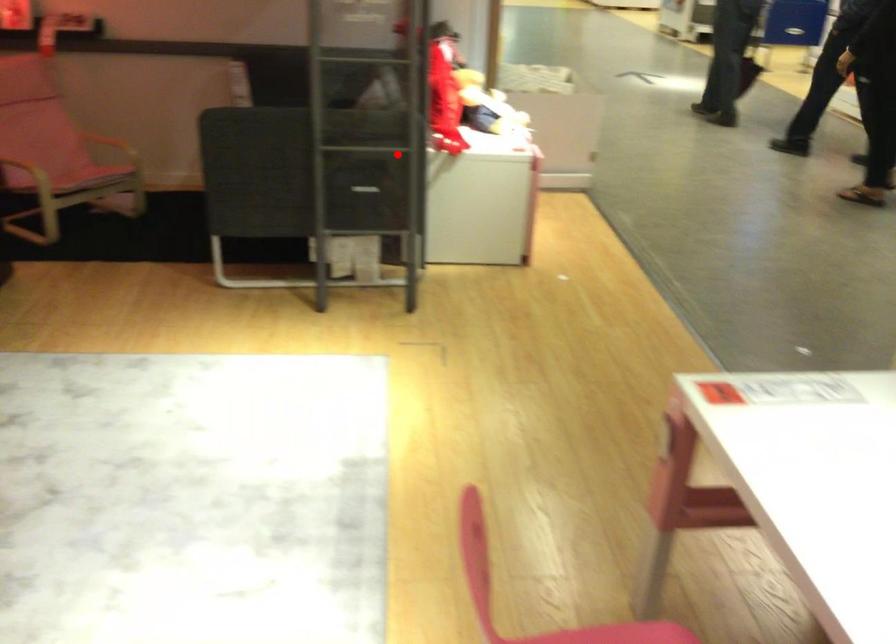
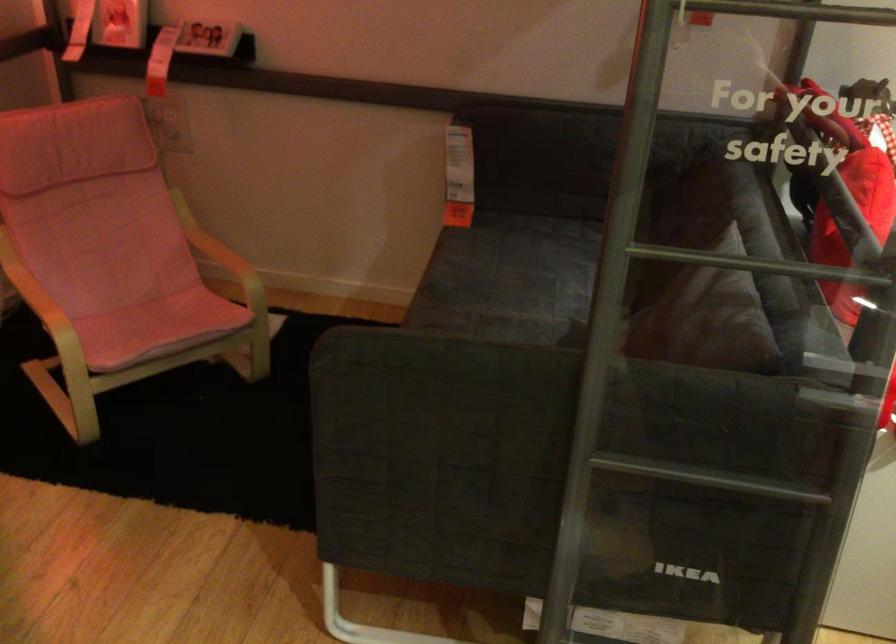
Question: I am providing you with two images of the same scene from different viewpoints. Given a red point in image1, look at the same physical point in image2. Is it:

Choices:
 (A) Closer to the viewpoint
 (B) Farther from the viewpoint

Answer: (A)